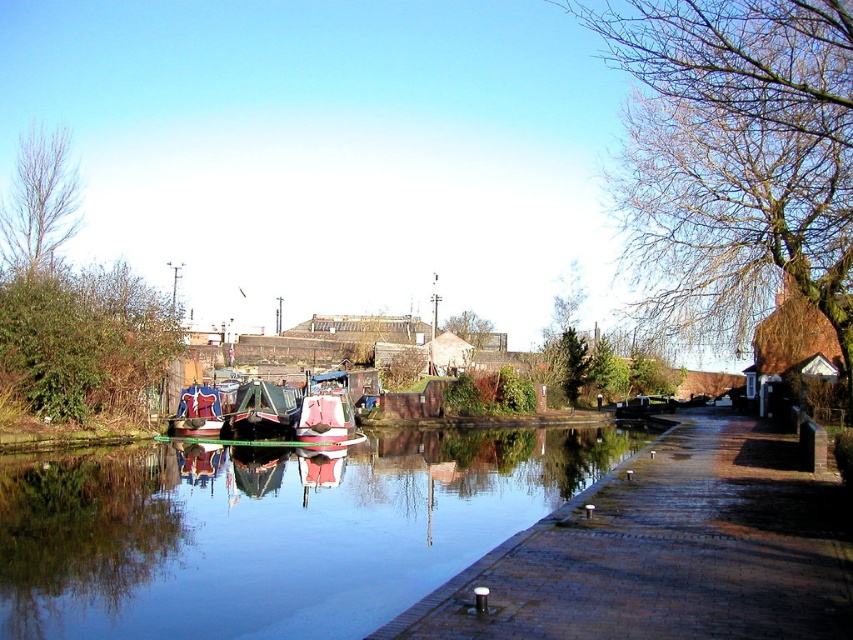
You are a delivery person carrying a package that requires a 2 meter long space to place. You see the brick paved path at center and the polished wood boat at center. Which one can accommodate the package?

The polished wood boat at center is longer than the brick paved path at center, so the polished wood boat at center can accommodate the package.

In the canal scene, you notice a red brick building with a sloped roof partially hidden by trees. You see the bare branches at upper right and the green leafy tree at left. From the perspective of someone standing in the middle of the pathway, which tree is closer to the canal?

The green leafy tree at left is closer to the canal because the bare branches at upper right are positioned to its right, meaning they are further away from the pathway and closer to the building.

You are a delivery person carrying a large package and need to choose between placing it on the brick paved path at center or the polished wood boat at center. Based on their sizes, which location can accommodate the package more comfortably?

The brick paved path at center is larger in size than the polished wood boat at center, so the package will fit more comfortably on the brick paved path at center.